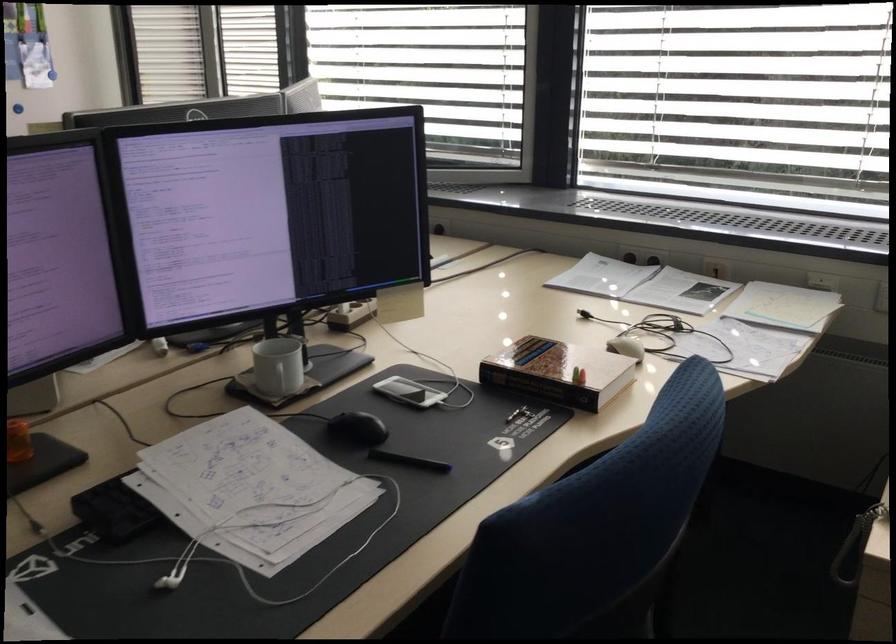
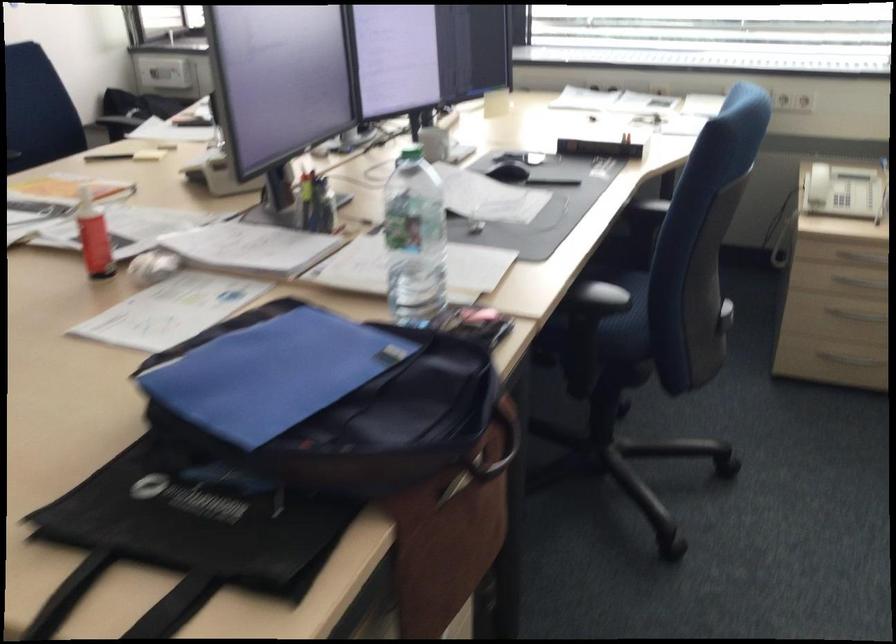
The point at [403,474] is marked in the first image. Where is the corresponding point in the second image?

(555, 182)